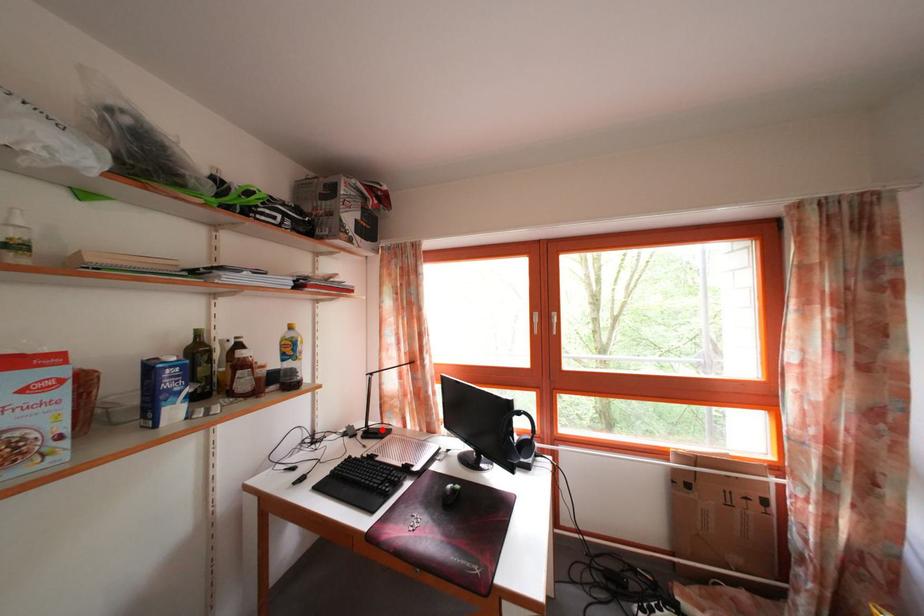
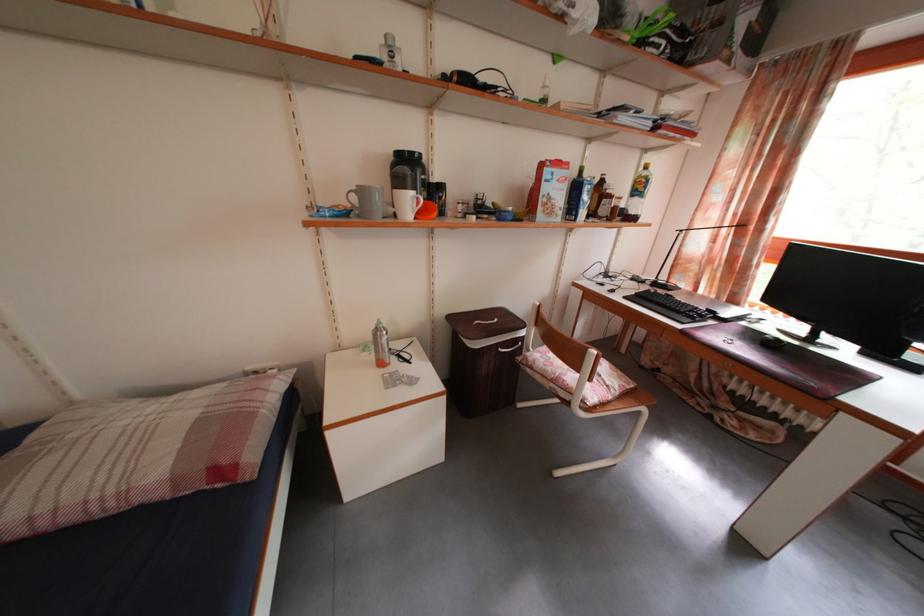
Find the pixel in the second image that matches the highlighted location in the first image.

(671, 285)